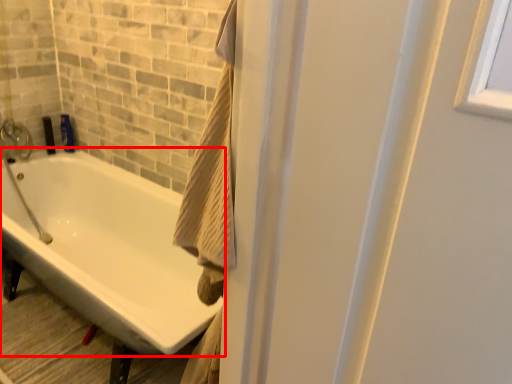
Question: Observing the image, what is the correct spatial positioning of bathtub (annotated by the red box) in reference to toiletry?

Choices:
 (A) right
 (B) left

Answer: (A)